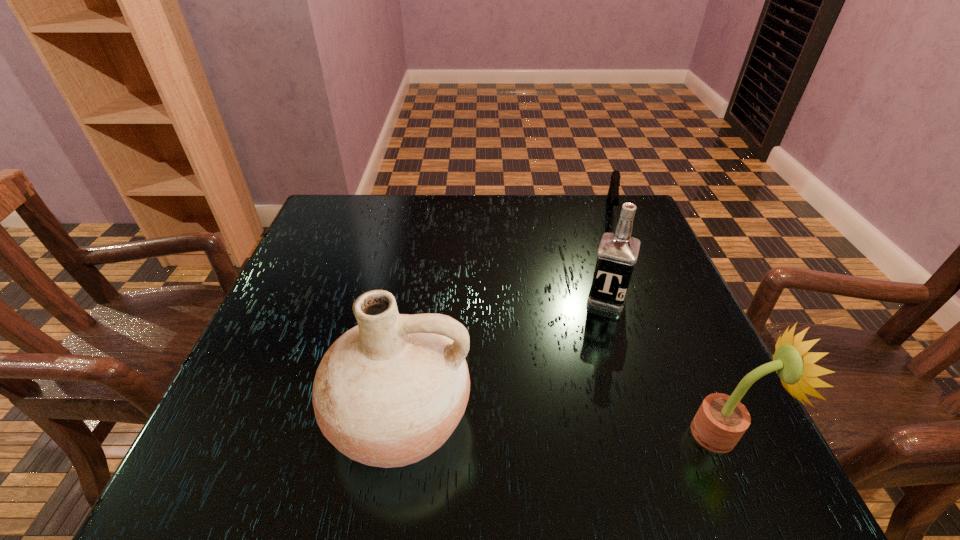
Identify the location of vacant space at the far edge. (417, 220).

Where is `blank space at the left edge of the desktop`? Image resolution: width=960 pixels, height=540 pixels. blank space at the left edge of the desktop is located at coordinates (279, 360).

The width and height of the screenshot is (960, 540). In order to click on blank area at the right edge in this screenshot , I will do `click(616, 316)`.

You are a GUI agent. You are given a task and a screenshot of the screen. Output one action in this format:
    pyautogui.click(x=<x>, y=<y>)
    Task: Click on the empty space between the leftmost object and the shortest object
    This screenshot has width=960, height=540.
    Given the screenshot: What is the action you would take?
    [505, 315]

You are a GUI agent. You are given a task and a screenshot of the screen. Output one action in this format:
    pyautogui.click(x=<x>, y=<y>)
    Task: Click on the vacant area that lies between the pottery and the second object from left to right
    This screenshot has height=540, width=960.
    Given the screenshot: What is the action you would take?
    pyautogui.click(x=503, y=357)

Where is `free area in between the sunflower and the third object from right to left`? free area in between the sunflower and the third object from right to left is located at coordinates (664, 366).

Locate an element on the screen. unoccupied position between the pistol and the sunflower is located at coordinates (666, 322).

This screenshot has width=960, height=540. Find the location of `blank region between the sunflower and the shortest object`. blank region between the sunflower and the shortest object is located at coordinates (666, 322).

Find the location of a particular element. This screenshot has height=540, width=960. empty space between the pottery and the vodka is located at coordinates (503, 357).

The width and height of the screenshot is (960, 540). Identify the location of empty space that is in between the pottery and the sunflower. (562, 426).